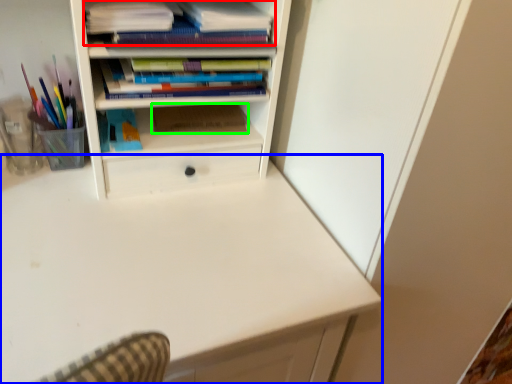
Question: Which object is positioned farthest from book (highlighted by a red box)? Select from computer desk (highlighted by a blue box) and paperback book (highlighted by a green box).

Choices:
 (A) computer desk
 (B) paperback book

Answer: (A)